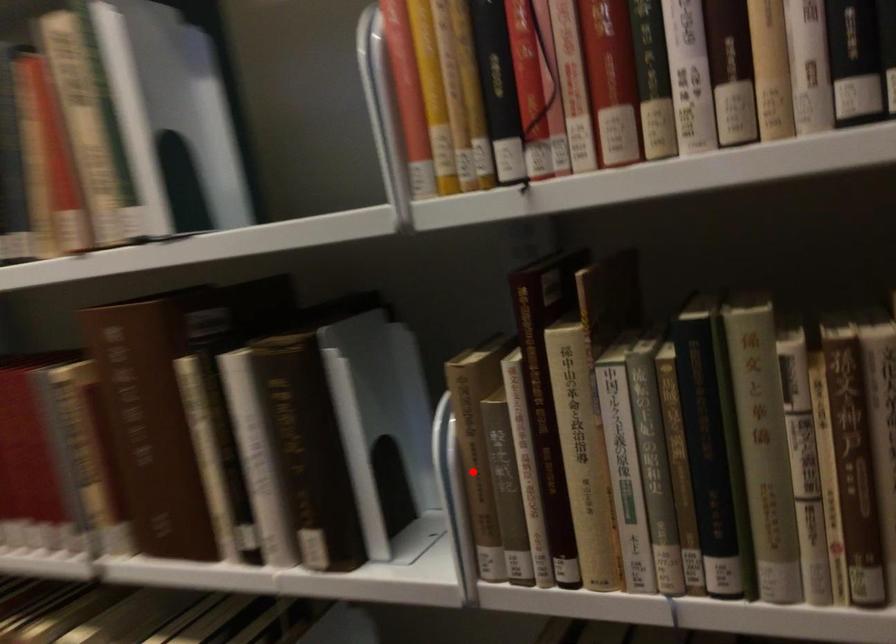
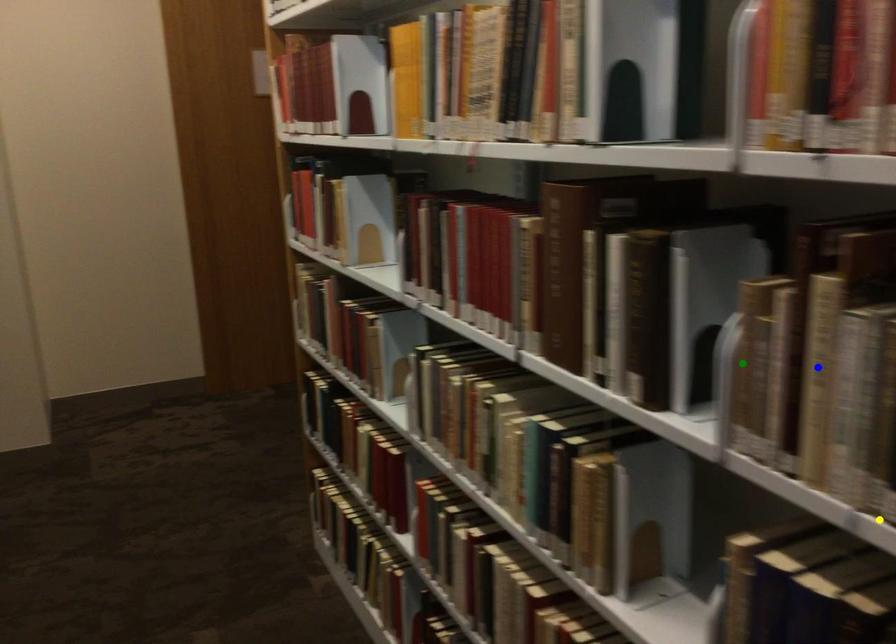
Question: I am providing you with two images of the same scene from different viewpoints. A red point is marked on the first image. You are given multiple points on the second image. Which point in image 2 represents the same 3d spot as the red point in image 1?

Choices:
 (A) blue point
 (B) yellow point
 (C) green point

Answer: (C)